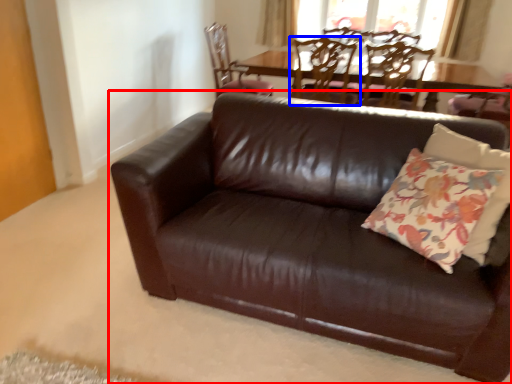
Question: Among these objects, which one is nearest to the camera, studio couch (highlighted by a red box) or chair (highlighted by a blue box)?

Choices:
 (A) studio couch
 (B) chair

Answer: (A)